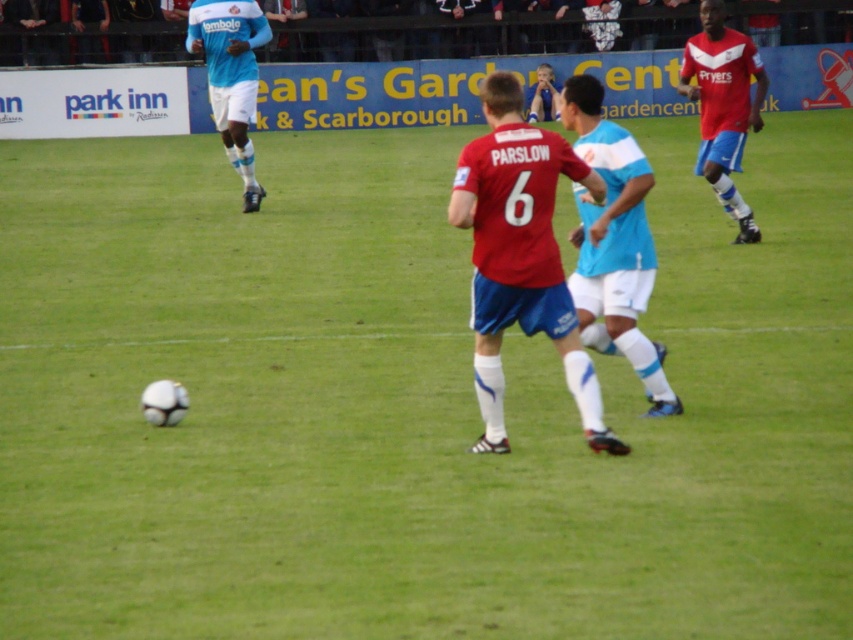
Question: Considering the real-world distances, which object is farthest from the light blue jersey at center?

Choices:
 (A) matte red jersey at center
 (B) red jersey at right
 (C) blue/white jersey at center

Answer: (A)

Question: Does matte red jersey at center appear over red jersey at right?

Choices:
 (A) yes
 (B) no

Answer: (B)

Question: Is red jersey at right in front of light blue jersey at center?

Choices:
 (A) no
 (B) yes

Answer: (B)

Question: Which object is the farthest from the red jersey at right?

Choices:
 (A) matte red jersey at center
 (B) light blue jersey at center

Answer: (A)

Question: Is the position of blue/white jersey at center less distant than that of red jersey at right?

Choices:
 (A) yes
 (B) no

Answer: (A)

Question: Among these points, which one is farthest from the camera?

Choices:
 (A) (495, 248)
 (B) (212, 97)

Answer: (B)